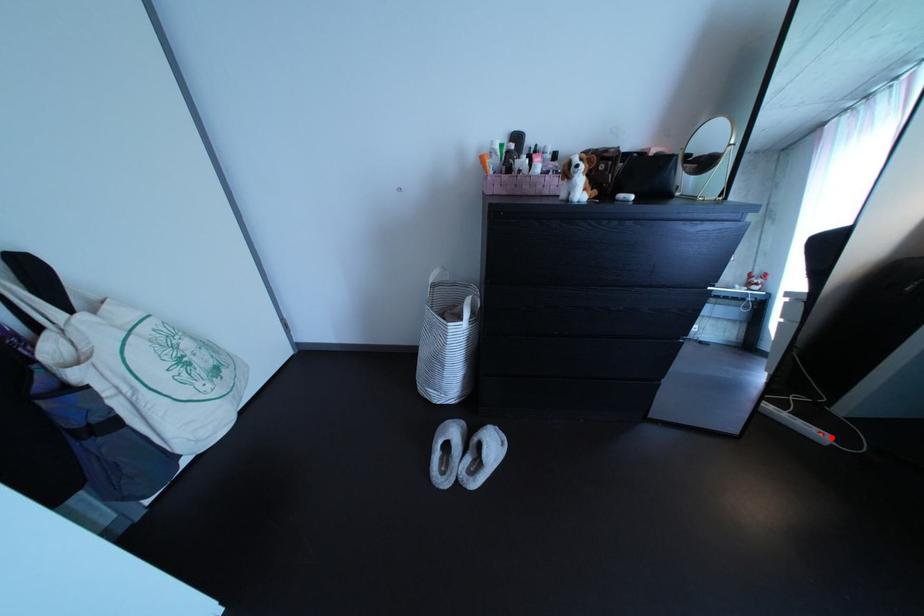
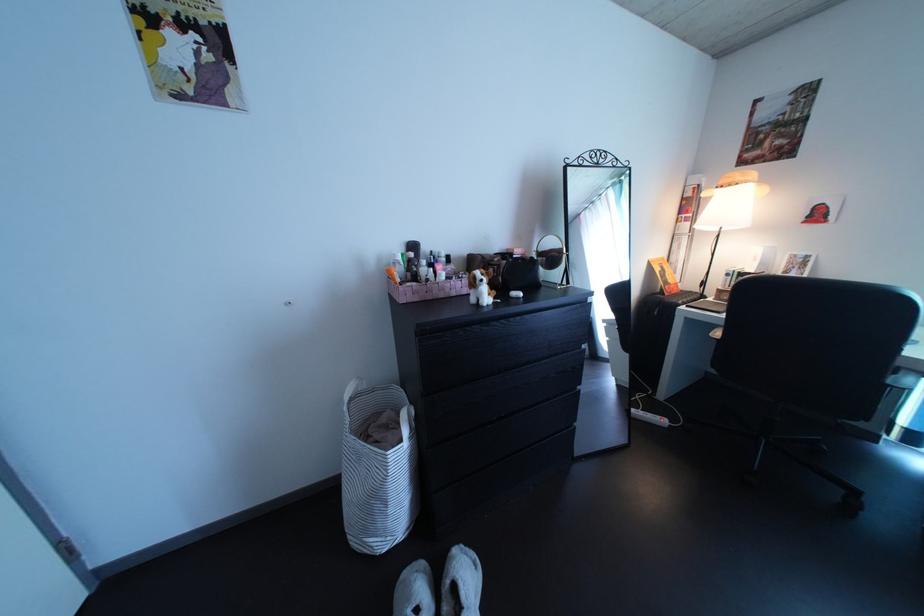
Question: I am providing you with two images of the same scene from different viewpoints. A red point is marked on the first image. At the location where the point appears in image 1, is it still visible in image 2?

Choices:
 (A) Yes
 (B) No

Answer: (A)